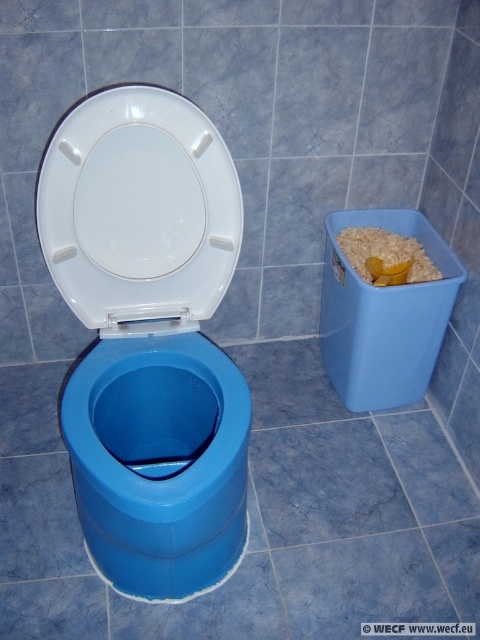
Question: Does white glossy toilet seat at center have a larger size compared to yellow plastic scoop at right?

Choices:
 (A) no
 (B) yes

Answer: (B)

Question: Among these objects, which one is nearest to the camera?

Choices:
 (A) blue plastic toilet bowl at center
 (B) yellow plastic scoop at right
 (C) white glossy toilet seat at center

Answer: (A)

Question: In this image, where is white glossy toilet seat at center located relative to yellow plastic scoop at right?

Choices:
 (A) above
 (B) below

Answer: (A)

Question: Which of the following is the farthest from the observer?

Choices:
 (A) (364, 243)
 (B) (79, 104)
 (C) (160, 520)

Answer: (A)

Question: Among these points, which one is nearest to the camera?

Choices:
 (A) (400, 236)
 (B) (220, 508)

Answer: (B)

Question: In this image, where is blue plastic toilet bowl at center located relative to yellow plastic scoop at right?

Choices:
 (A) below
 (B) above

Answer: (A)